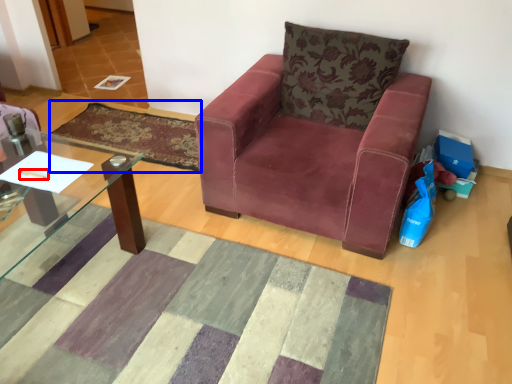
Question: Which object appears farthest to the camera in this image, pen (highlighted by a red box) or mat (highlighted by a blue box)?

Choices:
 (A) pen
 (B) mat

Answer: (B)